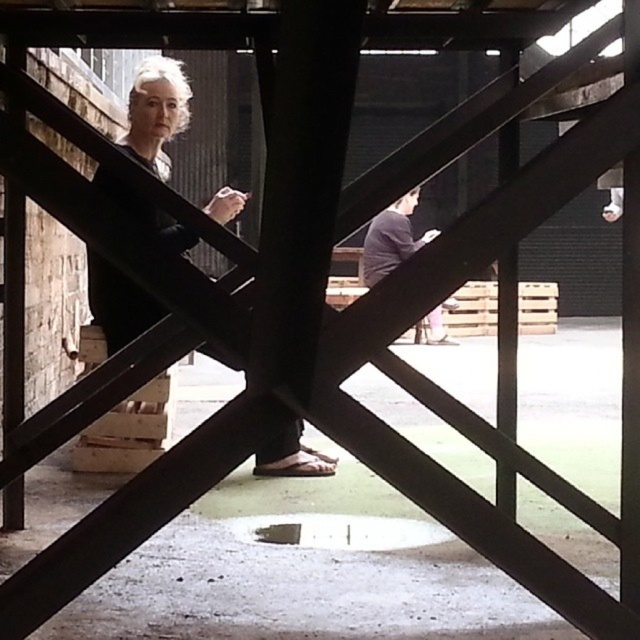
You are standing on the metal framework and see the wooden at lower left and the dark gray sweater at center. Which object is positioned lower in the scene?

The wooden at lower left is located below the dark gray sweater at center, so it is positioned lower in the scene.

You are an observer looking at the scene through the metal framework. You notice two items at the center of the image. Which one is taller between the dark brown leather jacket at center and the dark gray sweater at center?

The dark brown leather jacket at center is taller than the dark gray sweater at center.

You are an observer positioned at the origin point in the image. The dark brown leather jacket at center is located at coordinates 0.175, 0.244. If you move 0.1 units to the right along the x axis, will you be closer to the jacket?

Moving 0.1 units to the right along the x axis from the origin would place you at x coordinate 0.1, which is closer to the jacket at x 0.175 than the original position at x 0.0. Therefore, yes, you will be closer to the dark brown leather jacket at center.